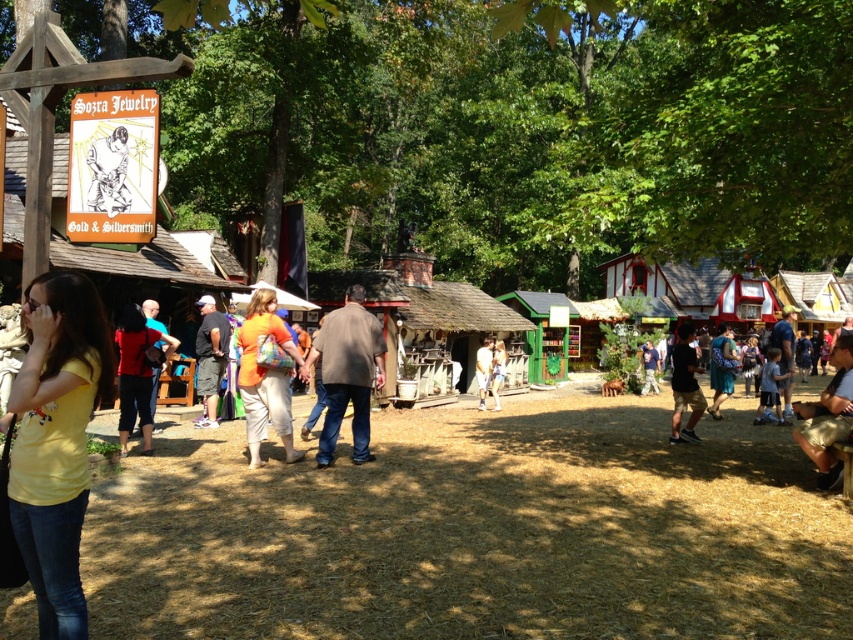
Is yellow matte t-shirt at lower left bigger than orange fabric purse at center?

No, yellow matte t-shirt at lower left is not bigger than orange fabric purse at center.

Who is more distant from viewer, (59,444) or (265,308)?

Point (265,308)

Which is in front, point (50, 417) or point (270, 381)?

Positioned in front is point (50, 417).

The image size is (853, 640). Identify the location of yellow matte t-shirt at lower left. (56, 440).